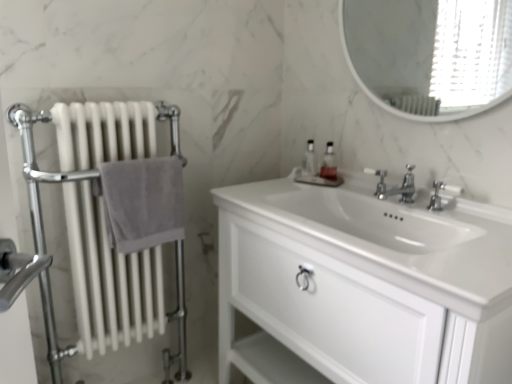
Identify the location of vacant space that's between polished chrome faucet at center, acting as the second tap starting from the left, and chrome metallic faucet at center, arranged as the second tap when viewed from the right. The height and width of the screenshot is (384, 512). (423, 213).